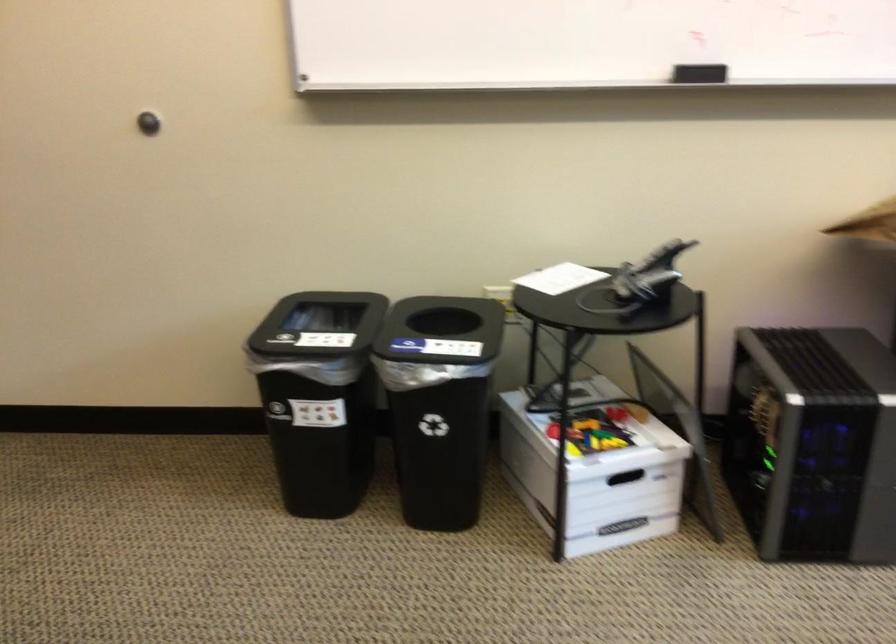
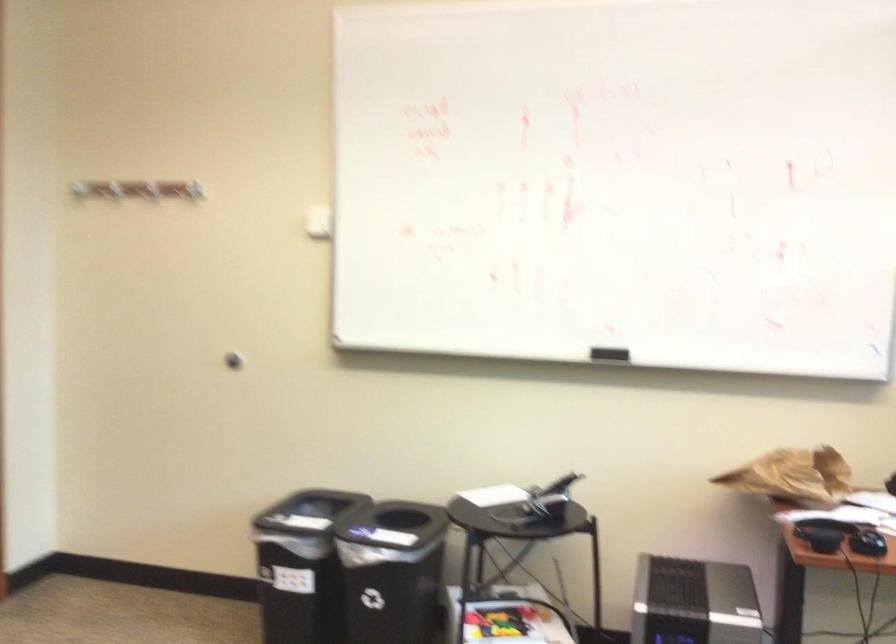
Locate, in the second image, the point that corresponds to pixel 331 395 in the first image.

(300, 565)